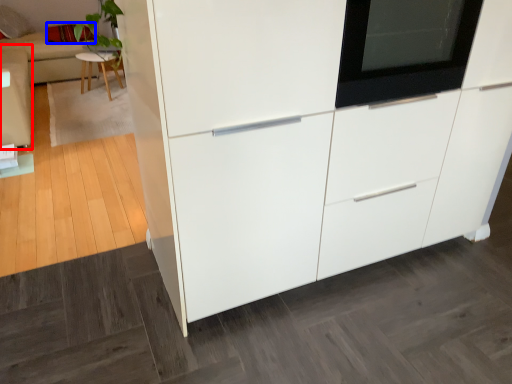
Question: Which point is closer to the camera, couch (highlighted by a red box) or pillow (highlighted by a blue box)?

Choices:
 (A) couch
 (B) pillow

Answer: (A)